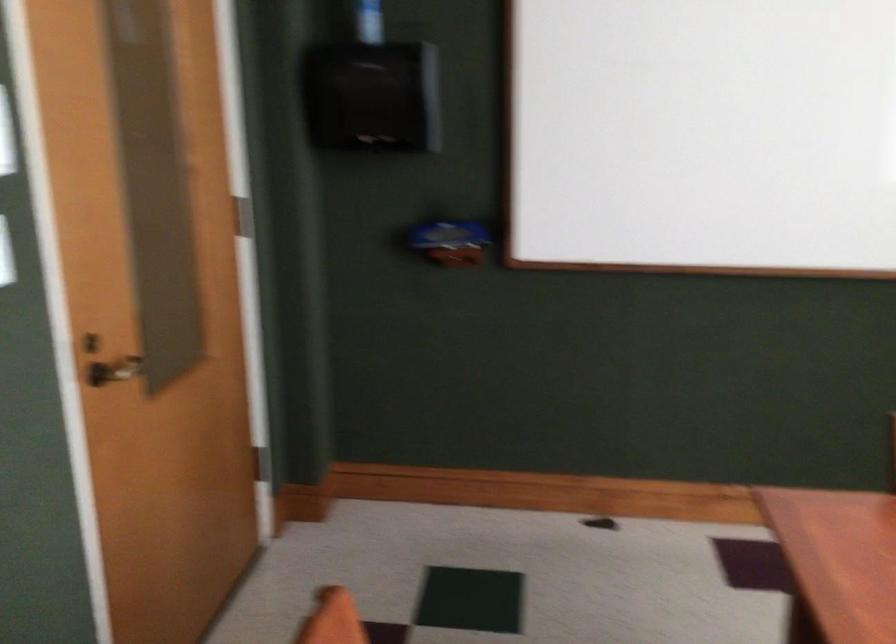
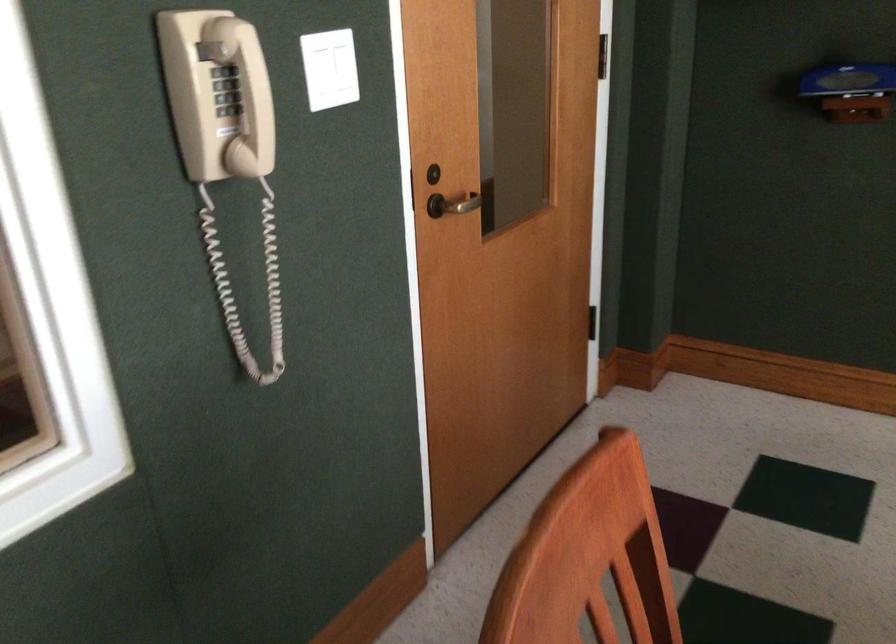
Where in the second image is the point corresponding to the point at 128,384 from the first image?

(458, 204)